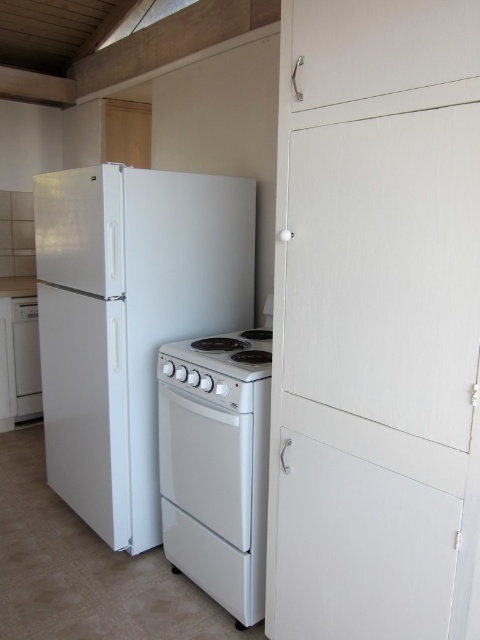
Question: Does white matte refrigerator at left appear over white glossy gas stove at center?

Choices:
 (A) no
 (B) yes

Answer: (A)

Question: Which of the following is the farthest from the observer?

Choices:
 (A) white glossy gas stove at center
 (B) white matte refrigerator at left
 (C) white glossy oven at center

Answer: (B)

Question: Does white matte refrigerator at left have a larger size compared to white glossy dishwasher at left?

Choices:
 (A) no
 (B) yes

Answer: (B)

Question: Is white glossy oven at center positioned before white glossy dishwasher at left?

Choices:
 (A) yes
 (B) no

Answer: (A)

Question: Which object is positioned farthest from the white glossy gas stove at center?

Choices:
 (A) white glossy dishwasher at left
 (B) white matte refrigerator at left

Answer: (A)

Question: Which object appears farthest from the camera in this image?

Choices:
 (A) white glossy dishwasher at left
 (B) white matte refrigerator at left
 (C) white glossy gas stove at center
 (D) white glossy oven at center

Answer: (A)